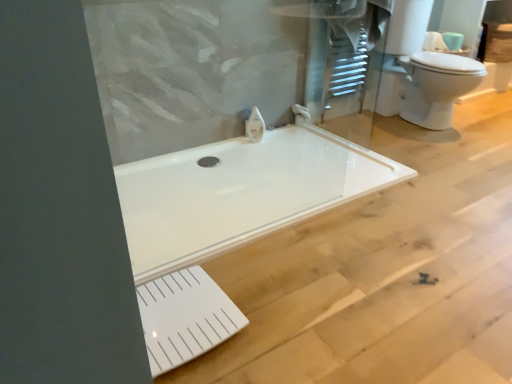
Question: Is white glossy faucet at upper center, positioned as the second faucet in back-to-front order, smaller than white glossy faucet at upper center, the second faucet viewed from the left?

Choices:
 (A) yes
 (B) no

Answer: (A)

Question: Can you confirm if white glossy faucet at upper center, positioned as the second faucet in back-to-front order, is positioned to the right of white glossy faucet at upper center, which ranks as the 1th faucet in right-to-left order?

Choices:
 (A) no
 (B) yes

Answer: (A)

Question: Is white glossy faucet at upper center, positioned as the second faucet in back-to-front order, outside white glossy faucet at upper center, the 2th faucet viewed from the front?

Choices:
 (A) no
 (B) yes

Answer: (B)

Question: Is white glossy faucet at upper center, which is the first faucet in front-to-back order, looking in the opposite direction of white glossy faucet at upper center, arranged as the first faucet when viewed from the back?

Choices:
 (A) no
 (B) yes

Answer: (A)

Question: Considering the relative positions of white glossy faucet at upper center, which ranks as the 2th faucet in right-to-left order, and white glossy faucet at upper center, which ranks as the 1th faucet in right-to-left order, in the image provided, is white glossy faucet at upper center, which ranks as the 2th faucet in right-to-left order, to the left of white glossy faucet at upper center, which ranks as the 1th faucet in right-to-left order, from the viewer's perspective?

Choices:
 (A) yes
 (B) no

Answer: (A)

Question: Is white glossy faucet at upper center, positioned as the second faucet in back-to-front order, aimed at white glossy faucet at upper center, the 2th faucet viewed from the front?

Choices:
 (A) yes
 (B) no

Answer: (B)

Question: Can you confirm if white glossy faucet at upper center, the second faucet viewed from the left, is smaller than white matte toilet paper at upper right?

Choices:
 (A) yes
 (B) no

Answer: (A)

Question: Is white glossy faucet at upper center, which ranks as the 1th faucet in right-to-left order, to the left of white matte toilet paper at upper right from the viewer's perspective?

Choices:
 (A) yes
 (B) no

Answer: (A)

Question: From the image's perspective, would you say white glossy faucet at upper center, which ranks as the 1th faucet in right-to-left order, is shown under white matte toilet paper at upper right?

Choices:
 (A) yes
 (B) no

Answer: (A)

Question: Does white glossy faucet at upper center, arranged as the first faucet when viewed from the back, come in front of white matte toilet paper at upper right?

Choices:
 (A) no
 (B) yes

Answer: (B)

Question: From a real-world perspective, is white glossy faucet at upper center, which ranks as the 1th faucet in right-to-left order, below white matte toilet paper at upper right?

Choices:
 (A) yes
 (B) no

Answer: (A)

Question: Is white glossy faucet at upper center, the 2th faucet viewed from the front, positioned behind white matte toilet paper at upper right?

Choices:
 (A) yes
 (B) no

Answer: (B)

Question: Considering the relative sizes of white glossy faucet at upper center, which ranks as the 2th faucet in right-to-left order, and white glossy toilet at upper right in the image provided, is white glossy faucet at upper center, which ranks as the 2th faucet in right-to-left order, smaller than white glossy toilet at upper right?

Choices:
 (A) no
 (B) yes

Answer: (B)